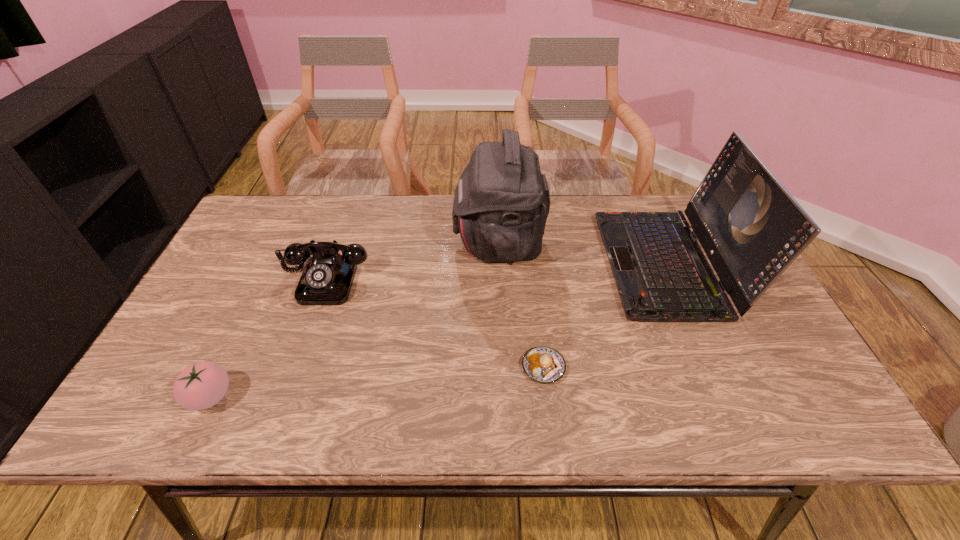
This screenshot has width=960, height=540. I want to click on object that is at the far right corner, so click(x=751, y=228).

The height and width of the screenshot is (540, 960). Find the location of `vacant space at the far edge`. vacant space at the far edge is located at coordinates (632, 208).

The height and width of the screenshot is (540, 960). I want to click on vacant area at the left edge of the desktop, so click(223, 340).

Identify the location of free space at the far left corner. This screenshot has width=960, height=540. (291, 226).

Find the location of `blank space at the near left corner of the desktop`. blank space at the near left corner of the desktop is located at coordinates (203, 418).

Identify the location of unoccupied area between the third shortest object and the tomato. (268, 338).

Image resolution: width=960 pixels, height=540 pixels. I want to click on vacant area that lies between the laptop computer and the second shortest object, so click(x=439, y=330).

Find the location of a particular element. This screenshot has height=540, width=960. vacant area that lies between the laptop computer and the shortest object is located at coordinates (605, 315).

Where is `free space between the shoulder bag and the rightmost object`? free space between the shoulder bag and the rightmost object is located at coordinates (583, 253).

This screenshot has width=960, height=540. I want to click on vacant space that is in between the telephone and the shoulder bag, so 412,260.